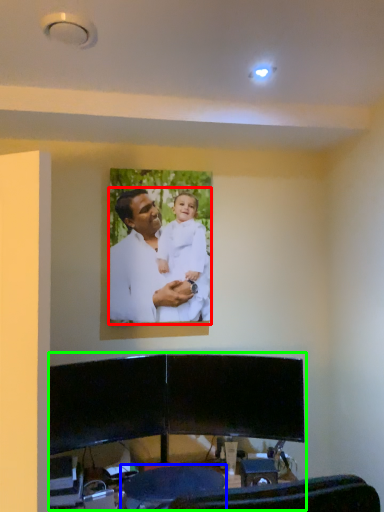
Question: Considering the real-world distances, which object is closest to man (highlighted by a red box)? swivel chair (highlighted by a blue box) or entertainment center (highlighted by a green box).

Choices:
 (A) swivel chair
 (B) entertainment center

Answer: (B)